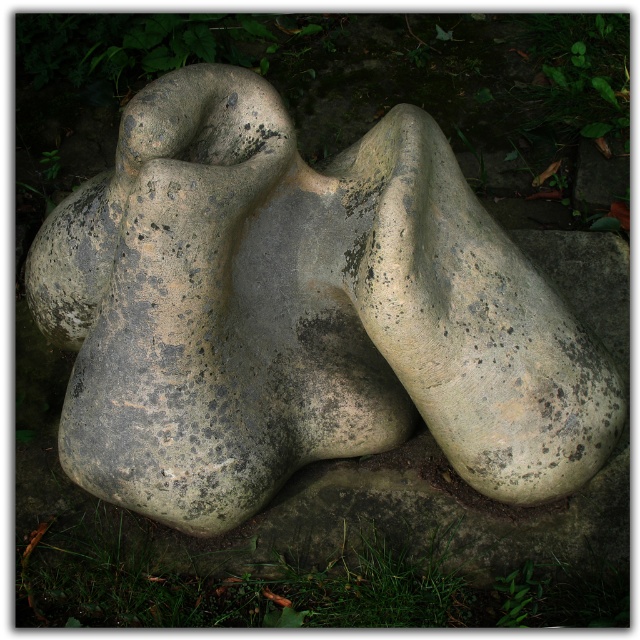
You are a landscape architect designing a garden and want to place a new rectangular flower bed between the gray stone sculpture at center and the green grass at lower center. The flower bed must be wider than both objects. Is this possible?

The gray stone sculpture at center is narrower than the green grass at lower center. Since the flower bed needs to be wider than both, it must exceed the width of the wider object, which is the green grass at lower center. Therefore, it is possible as long as the flower bed is designed wider than the green grass at lower center.

You are standing in front of the gray stone sculpture at center and want to walk towards the green grass at lower center. In which direction should you move?

You should move to the left because the gray stone sculpture at center is to the right of the green grass at lower center, so moving left will take you toward the green grass at lower center.

You are standing in front of the gray stone sculpture at center and want to step onto the green grass at lower center. Can you step directly from the sculpture to the grass without needing to move sideways?

The gray stone sculpture at center is closer to the viewer than green grass at lower center, so yes, you can step directly from the sculpture to the grass without needing to move sideways since the grass is positioned behind the sculpture.